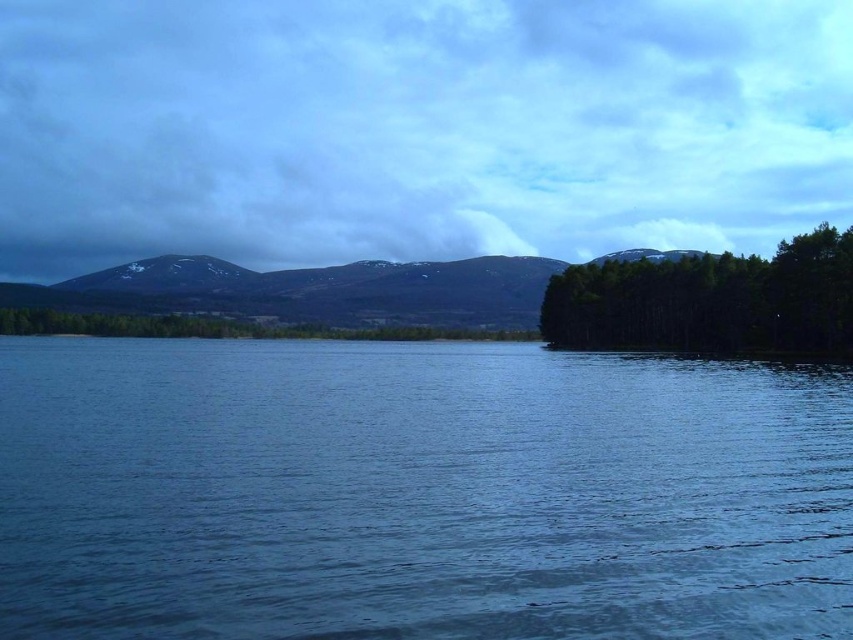
Question: From the image, what is the correct spatial relationship of blue water at center in relation to green matte trees at right?

Choices:
 (A) below
 (B) above

Answer: (A)

Question: Does blue water at center appear over green matte trees at right?

Choices:
 (A) yes
 (B) no

Answer: (B)

Question: Is blue water at center wider than green matte trees at right?

Choices:
 (A) no
 (B) yes

Answer: (B)

Question: Which of the following is the closest to the observer?

Choices:
 (A) (97, 472)
 (B) (845, 280)

Answer: (A)

Question: Which of the following is the closest to the observer?

Choices:
 (A) blue water at center
 (B) green matte trees at right

Answer: (A)